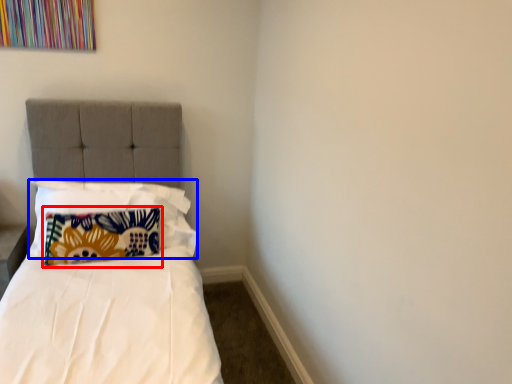
Question: Among these objects, which one is nearest to the camera, pillow (highlighted by a red box) or pillow (highlighted by a blue box)?

Choices:
 (A) pillow
 (B) pillow

Answer: (B)